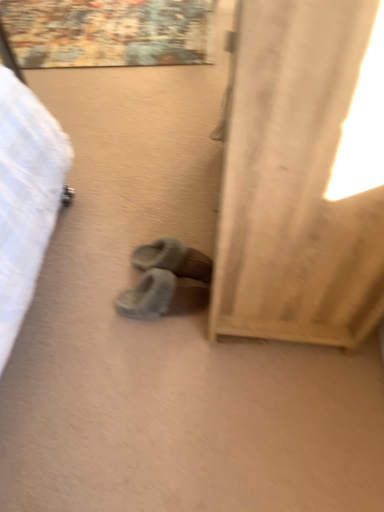
Describe the element at coordinates (162, 296) in the screenshot. This screenshot has width=384, height=512. I see `fuzzy suede slippers at center, the 1th footwear when ordered from bottom to top` at that location.

Locate an element on the screen. The image size is (384, 512). fuzzy suede slippers at center, the 1th footwear when ordered from bottom to top is located at coordinates (162, 296).

This screenshot has width=384, height=512. I want to click on fuzzy suede slippers at center, placed as the 2th footwear when sorted from top to bottom, so click(162, 296).

Which is farther from the camera, (295, 9) or (154, 267)?

The point (154, 267) is farther.

Is beige fabric curtain at right taller or shorter than gray fuzzy slippers at center, placed as the 1th footwear when sorted from top to bottom?

Clearly, beige fabric curtain at right is taller compared to gray fuzzy slippers at center, placed as the 1th footwear when sorted from top to bottom.

From the image's perspective, which is below, beige fabric curtain at right or gray fuzzy slippers at center, placed as the 1th footwear when sorted from top to bottom?

From the image's view, gray fuzzy slippers at center, placed as the 1th footwear when sorted from top to bottom, is below.

Considering the relative sizes of gray fuzzy slippers at center, placed as the 1th footwear when sorted from top to bottom, and beige fabric curtain at right in the image provided, is gray fuzzy slippers at center, placed as the 1th footwear when sorted from top to bottom, smaller than beige fabric curtain at right?

Yes, gray fuzzy slippers at center, placed as the 1th footwear when sorted from top to bottom, is smaller than beige fabric curtain at right.

From a real-world perspective, which footwear is the 1st one underneath the beige fabric curtain at right? Please provide its 2D coordinates.

[(173, 259)]

How much distance is there between gray fuzzy slippers at center, placed as the 1th footwear when sorted from top to bottom, and beige fabric curtain at right?

They are 17.19 inches apart.

From the image's perspective, which is above, gray fuzzy slippers at center, the 2th footwear from the bottom, or beige fabric curtain at right?

beige fabric curtain at right.

Consider the image. Does fuzzy suede slippers at center, the 1th footwear when ordered from bottom to top, come in front of gray fuzzy slippers at center, placed as the 1th footwear when sorted from top to bottom?

Yes, fuzzy suede slippers at center, the 1th footwear when ordered from bottom to top, is closer to the viewer.

Is fuzzy suede slippers at center, the 1th footwear when ordered from bottom to top, completely or partially outside of gray fuzzy slippers at center, placed as the 1th footwear when sorted from top to bottom?

Yes, fuzzy suede slippers at center, the 1th footwear when ordered from bottom to top, is outside of gray fuzzy slippers at center, placed as the 1th footwear when sorted from top to bottom.

Is fuzzy suede slippers at center, the 1th footwear when ordered from bottom to top, to the left or to the right of gray fuzzy slippers at center, placed as the 1th footwear when sorted from top to bottom, in the image?

Based on their positions, fuzzy suede slippers at center, the 1th footwear when ordered from bottom to top, is located to the left of gray fuzzy slippers at center, placed as the 1th footwear when sorted from top to bottom.

In the scene shown: Which of these two, fuzzy suede slippers at center, the 1th footwear when ordered from bottom to top, or gray fuzzy slippers at center, the 2th footwear from the bottom, is wider?

gray fuzzy slippers at center, the 2th footwear from the bottom.

From a real-world perspective, is fuzzy suede slippers at center, placed as the 2th footwear when sorted from top to bottom, beneath beige fabric curtain at right?

Indeed, from a real-world perspective, fuzzy suede slippers at center, placed as the 2th footwear when sorted from top to bottom, is positioned beneath beige fabric curtain at right.

What's the angular difference between fuzzy suede slippers at center, placed as the 2th footwear when sorted from top to bottom, and beige fabric curtain at right's facing directions?

The facing directions of fuzzy suede slippers at center, placed as the 2th footwear when sorted from top to bottom, and beige fabric curtain at right are 0.189 degrees apart.

Who is taller, fuzzy suede slippers at center, the 1th footwear when ordered from bottom to top, or beige fabric curtain at right?

With more height is beige fabric curtain at right.

Considering the relative sizes of fuzzy suede slippers at center, the 1th footwear when ordered from bottom to top, and beige fabric curtain at right in the image provided, is fuzzy suede slippers at center, the 1th footwear when ordered from bottom to top, smaller than beige fabric curtain at right?

Indeed, fuzzy suede slippers at center, the 1th footwear when ordered from bottom to top, has a smaller size compared to beige fabric curtain at right.

From the image's perspective, which is above, beige fabric curtain at right or fuzzy suede slippers at center, the 1th footwear when ordered from bottom to top?

beige fabric curtain at right is shown above in the image.

Considering the relative sizes of beige fabric curtain at right and fuzzy suede slippers at center, placed as the 2th footwear when sorted from top to bottom, in the image provided, is beige fabric curtain at right wider than fuzzy suede slippers at center, placed as the 2th footwear when sorted from top to bottom,?

Yes.

Looking at the image, does beige fabric curtain at right seem bigger or smaller compared to fuzzy suede slippers at center, the 1th footwear when ordered from bottom to top?

beige fabric curtain at right is bigger than fuzzy suede slippers at center, the 1th footwear when ordered from bottom to top.

Image resolution: width=384 pixels, height=512 pixels. I want to click on curtain located on the right of fuzzy suede slippers at center, the 1th footwear when ordered from bottom to top, so click(x=303, y=176).

From a real-world perspective, is gray fuzzy slippers at center, placed as the 1th footwear when sorted from top to bottom, on fuzzy suede slippers at center, the 1th footwear when ordered from bottom to top?

Yes, from a real-world perspective, gray fuzzy slippers at center, placed as the 1th footwear when sorted from top to bottom, is above fuzzy suede slippers at center, the 1th footwear when ordered from bottom to top.

Is gray fuzzy slippers at center, placed as the 1th footwear when sorted from top to bottom, bigger or smaller than fuzzy suede slippers at center, placed as the 2th footwear when sorted from top to bottom?

Considering their sizes, gray fuzzy slippers at center, placed as the 1th footwear when sorted from top to bottom, takes up less space than fuzzy suede slippers at center, placed as the 2th footwear when sorted from top to bottom.

Would you say gray fuzzy slippers at center, placed as the 1th footwear when sorted from top to bottom, is to the left or to the right of fuzzy suede slippers at center, placed as the 2th footwear when sorted from top to bottom, in the picture?

Clearly, gray fuzzy slippers at center, placed as the 1th footwear when sorted from top to bottom, is on the right of fuzzy suede slippers at center, placed as the 2th footwear when sorted from top to bottom, in the image.

Is gray fuzzy slippers at center, the 2th footwear from the bottom, in front of fuzzy suede slippers at center, placed as the 2th footwear when sorted from top to bottom?

That is False.

Find the location of a particular element. The width and height of the screenshot is (384, 512). curtain lying above the gray fuzzy slippers at center, placed as the 1th footwear when sorted from top to bottom (from the image's perspective) is located at coordinates (303, 176).

From the beige fabric curtain at right, count the 1st footwear to the left and point to it. Please provide its 2D coordinates.

[(173, 259)]

Based on their spatial positions, is gray fuzzy slippers at center, the 2th footwear from the bottom, or beige fabric curtain at right further from fuzzy suede slippers at center, placed as the 2th footwear when sorted from top to bottom?

Based on the image, beige fabric curtain at right appears to be further to fuzzy suede slippers at center, placed as the 2th footwear when sorted from top to bottom.

Looking at the image, which one is located closer to beige fabric curtain at right, gray fuzzy slippers at center, placed as the 1th footwear when sorted from top to bottom, or fuzzy suede slippers at center, placed as the 2th footwear when sorted from top to bottom?

fuzzy suede slippers at center, placed as the 2th footwear when sorted from top to bottom.

From the image, which object appears to be nearer to fuzzy suede slippers at center, the 1th footwear when ordered from bottom to top, beige fabric curtain at right or gray fuzzy slippers at center, the 2th footwear from the bottom?

The object closer to fuzzy suede slippers at center, the 1th footwear when ordered from bottom to top, is gray fuzzy slippers at center, the 2th footwear from the bottom.

When comparing their distances from beige fabric curtain at right, does fuzzy suede slippers at center, the 1th footwear when ordered from bottom to top, or gray fuzzy slippers at center, the 2th footwear from the bottom, seem closer?

fuzzy suede slippers at center, the 1th footwear when ordered from bottom to top.

Estimate the real-world distances between objects in this image. Which object is closer to gray fuzzy slippers at center, the 2th footwear from the bottom, beige fabric curtain at right or fuzzy suede slippers at center, placed as the 2th footwear when sorted from top to bottom?

fuzzy suede slippers at center, placed as the 2th footwear when sorted from top to bottom, is closer to gray fuzzy slippers at center, the 2th footwear from the bottom.

From the image, which object appears to be farther from gray fuzzy slippers at center, the 2th footwear from the bottom, fuzzy suede slippers at center, the 1th footwear when ordered from bottom to top, or beige fabric curtain at right?

The object further to gray fuzzy slippers at center, the 2th footwear from the bottom, is beige fabric curtain at right.

Image resolution: width=384 pixels, height=512 pixels. In order to click on footwear between beige fabric curtain at right and gray fuzzy slippers at center, the 2th footwear from the bottom, in the front-back direction in this screenshot , I will do `click(162, 296)`.